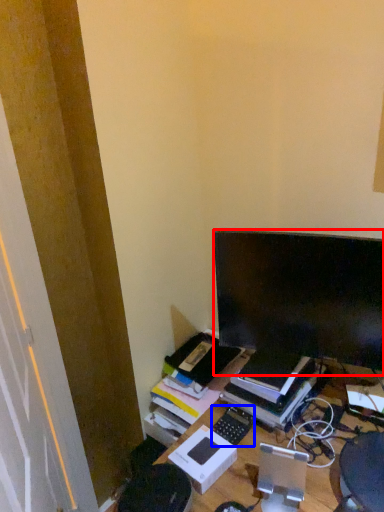
Question: Which point is further to the camera, computer monitor (highlighted by a red box) or computer keyboard (highlighted by a blue box)?

Choices:
 (A) computer monitor
 (B) computer keyboard

Answer: (B)